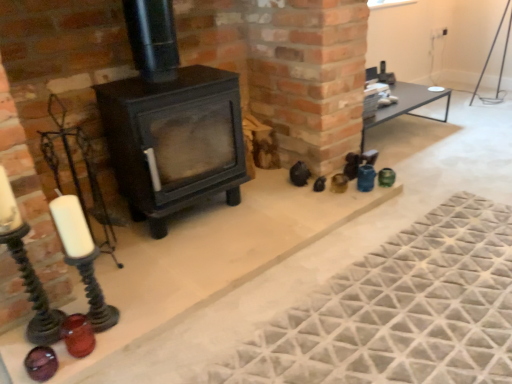
Identify the location of free location to the right of matte black wood burning stove at center. (269, 210).